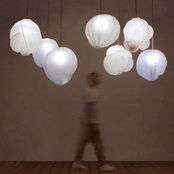
I want to click on wall, so click(x=126, y=126).